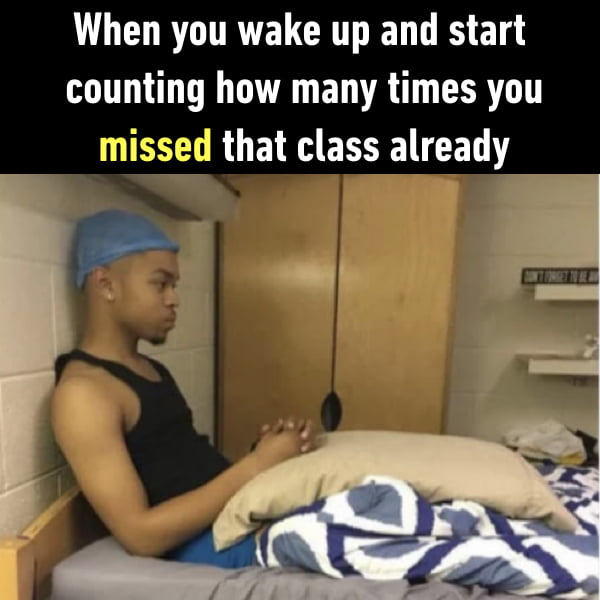
At what (x,y) coordinates should I click in order to perform the action: click on yellow pillow. Please return your answer as a coordinate pair (x, y). Looking at the image, I should click on (488, 463).